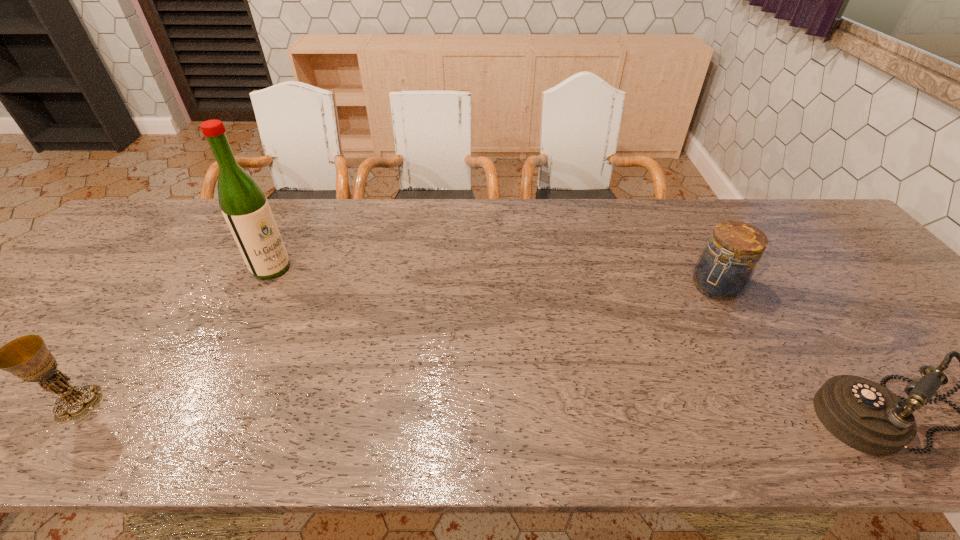
Find the location of a particular element. The width and height of the screenshot is (960, 540). the leftmost object is located at coordinates (27, 357).

Identify the location of jar. (723, 271).

I want to click on the third object from right to left, so tap(244, 206).

Find the location of a particular element. The image size is (960, 540). the tallest object is located at coordinates (244, 206).

Identify the location of free spot located on the back of the leftmost object. This screenshot has width=960, height=540. (183, 262).

What are the coordinates of `vacant space situated 0.160m on the lid of the jar` in the screenshot? It's located at (674, 332).

The width and height of the screenshot is (960, 540). Identify the location of free space located on the lid of the jar. (629, 381).

Image resolution: width=960 pixels, height=540 pixels. What are the coordinates of `vacant space situated on the lid of the jar` in the screenshot? It's located at (663, 343).

What are the coordinates of `vacant space positioned 0.250m on the label of the third object from right to left` in the screenshot? It's located at (348, 313).

Identify the location of vacant position located 0.160m on the label of the third object from right to left. The width and height of the screenshot is (960, 540). (324, 299).